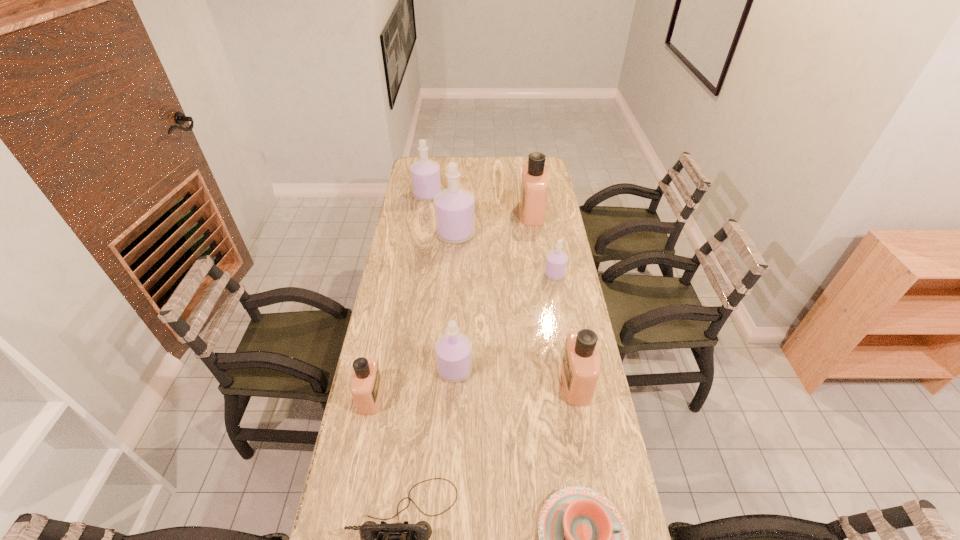
Identify the location of vacant space at the left edge. pos(421,264).

Find the location of a particular element. This screenshot has height=540, width=960. free space at the right edge of the desktop is located at coordinates (557, 217).

Locate an element on the screen. The height and width of the screenshot is (540, 960). vacant region at the far right corner of the desktop is located at coordinates (522, 172).

The width and height of the screenshot is (960, 540). Find the location of `vacant area that lies between the fourth nearest perfume and the second smallest beige perfume`. vacant area that lies between the fourth nearest perfume and the second smallest beige perfume is located at coordinates (565, 328).

Identify the location of free space that is in between the second biggest purple perfume and the second biggest beige perfume. Image resolution: width=960 pixels, height=540 pixels. (501, 289).

This screenshot has height=540, width=960. In order to click on free point between the second smallest beige perfume and the tallest perfume in this screenshot , I will do click(516, 308).

This screenshot has height=540, width=960. I want to click on vacant area that lies between the second smallest purple perfume and the second biggest purple perfume, so click(441, 282).

At what (x,y) coordinates should I click in order to perform the action: click on vacant point located between the farthest beige perfume and the farthest purple perfume. Please return your answer as a coordinate pair (x, y). Looking at the image, I should click on (480, 204).

Locate an element on the screen. The image size is (960, 540). free space between the second smallest beige perfume and the third biggest purple perfume is located at coordinates (516, 376).

Find the location of `vacant area between the third nearest purple perfume and the rightmost purple perfume`. vacant area between the third nearest purple perfume and the rightmost purple perfume is located at coordinates (505, 254).